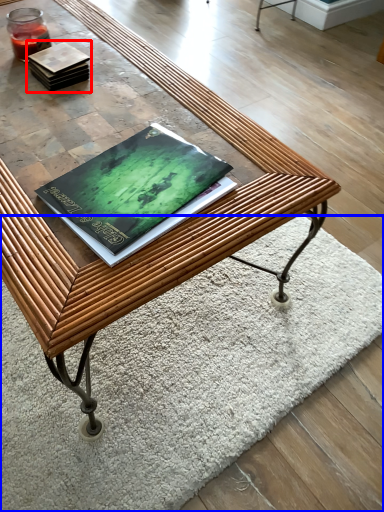
Question: Which object appears farthest to the camera in this image, book (highlighted by a red box) or mat (highlighted by a blue box)?

Choices:
 (A) book
 (B) mat

Answer: (A)